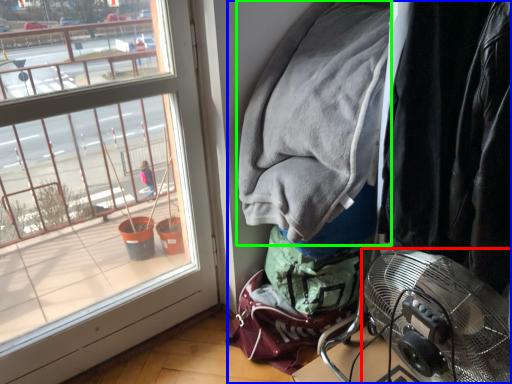
Question: Considering the real-world distances, which object is farthest from mechanical fan (highlighted by a red box)? closet (highlighted by a blue box) or jacket (highlighted by a green box)?

Choices:
 (A) closet
 (B) jacket

Answer: (B)